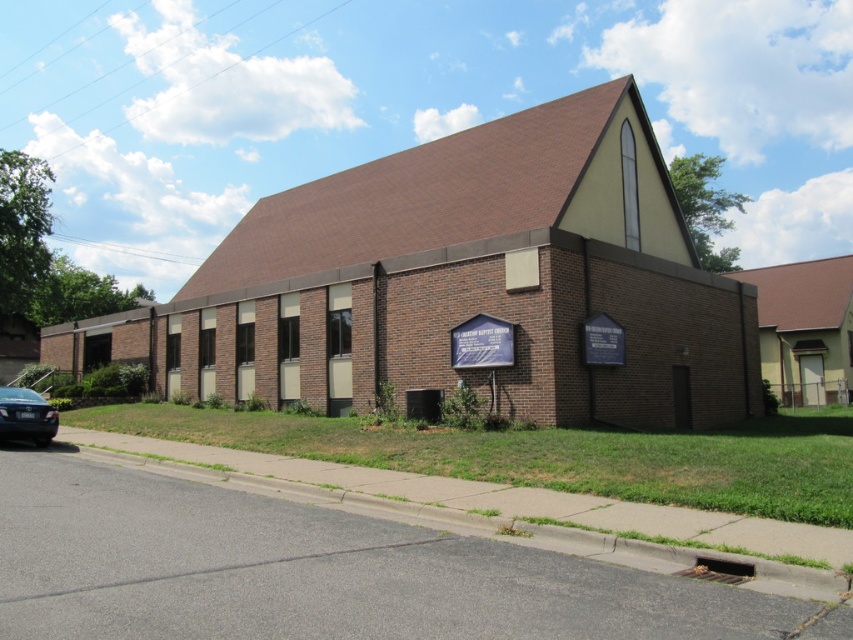
You are a delivery driver who needs to park your shiny black sedan at lower left as close as possible to the brown brick church at center without blocking the entrance. Considering the width of both objects, which one is wider and why does it matter?

The brown brick church at center is wider than the shiny black sedan at lower left. Since the church is wider, parking the sedan closer to it without blocking the entrance is feasible as long as the sedan stays within the church building area, but you must ensure not to obstruct the entrance path.

You are a visitor arriving at the location and see the brown brick church at center and the shiny black sedan at lower left. Which direction should you turn to face the church from the sedan?

You should turn to your right to face the brown brick church at center from the shiny black sedan at lower left since the church is positioned to the right of the sedan.

You are standing at the entrance of the brick building and see two points marked on the wall. The first point is at coordinates point (x=479, y=163) and the second is at point (x=53, y=410). Which point is closer to you?

Point (x=53, y=410) is closer to you because it is in front of point (x=479, y=163), which is behind it.